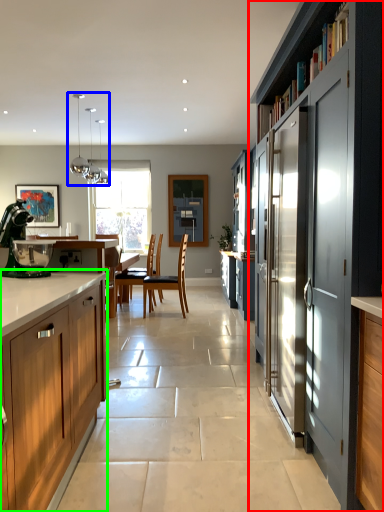
Question: Estimate the real-world distances between objects in this image. Which object is closer to cabinetry (highlighted by a red box), light fixture (highlighted by a blue box) or cabinetry (highlighted by a green box)?

Choices:
 (A) light fixture
 (B) cabinetry

Answer: (B)